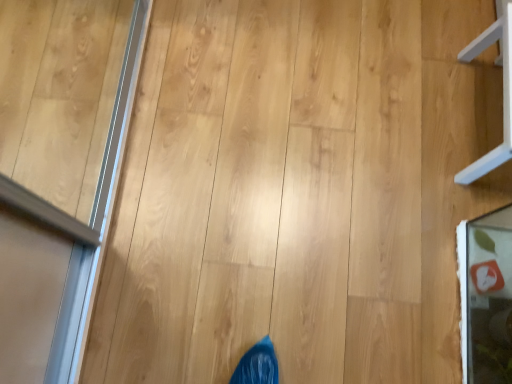
Identify the location of free spot behind white matte chair at right. The height and width of the screenshot is (384, 512). (440, 31).